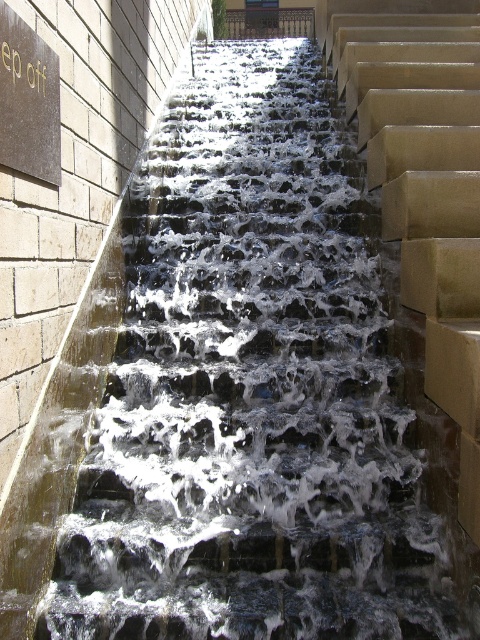
You are an architect designing a new water feature. You need to know the relative heights of the objects in the scene to ensure proper water flow. Which object is shorter between the matte black sign at upper left and the dark brown wrought iron at upper center?

The matte black sign at upper left is shorter than the dark brown wrought iron at upper center because the description states it is not as tall as the wrought iron.